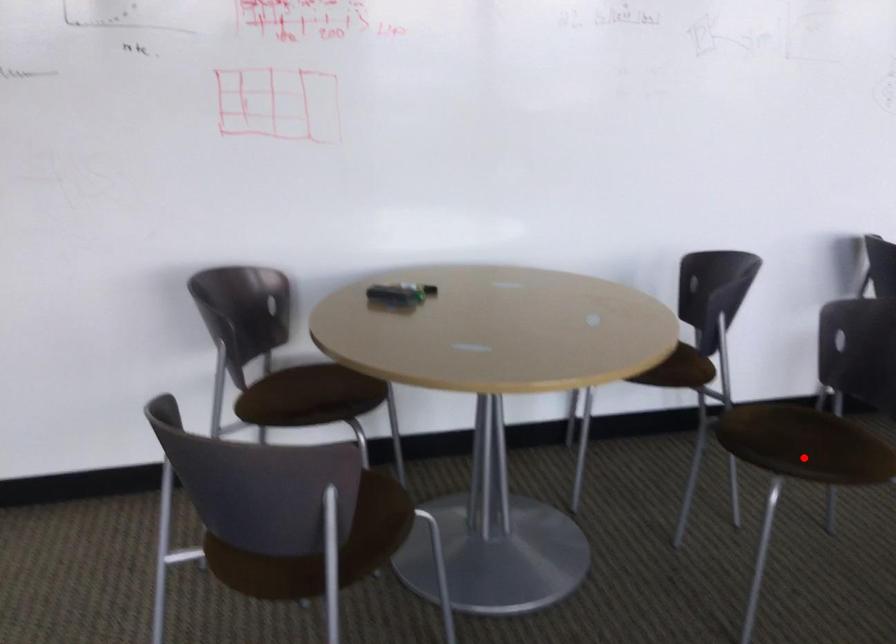
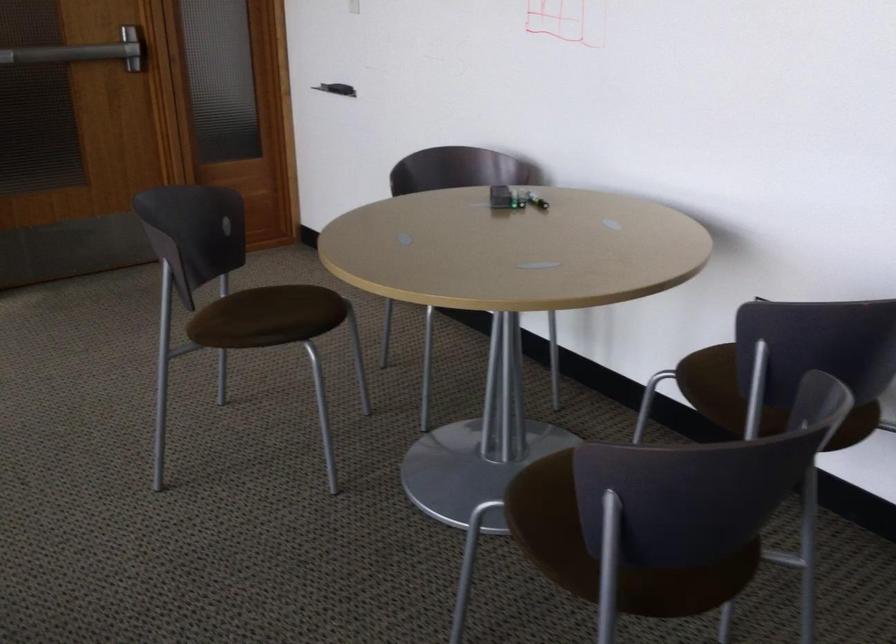
Question: A red point is marked in image1. In image2, is the corresponding 3D point closer to the camera or farther? Reply with the corresponding letter.

Choices:
 (A) The corresponding 3D point is closer.
 (B) The corresponding 3D point is farther.

Answer: (A)